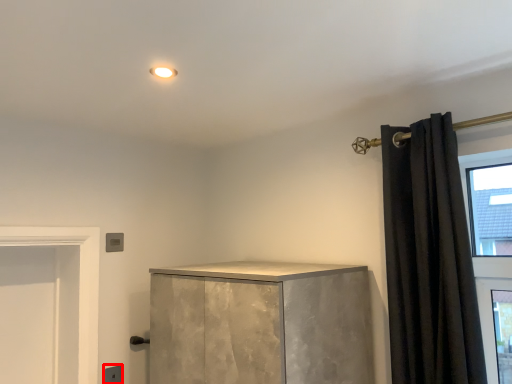
Question: From the image's perspective, where is electric outlet (annotated by the red box) located in relation to curtain in the image?

Choices:
 (A) above
 (B) below

Answer: (B)